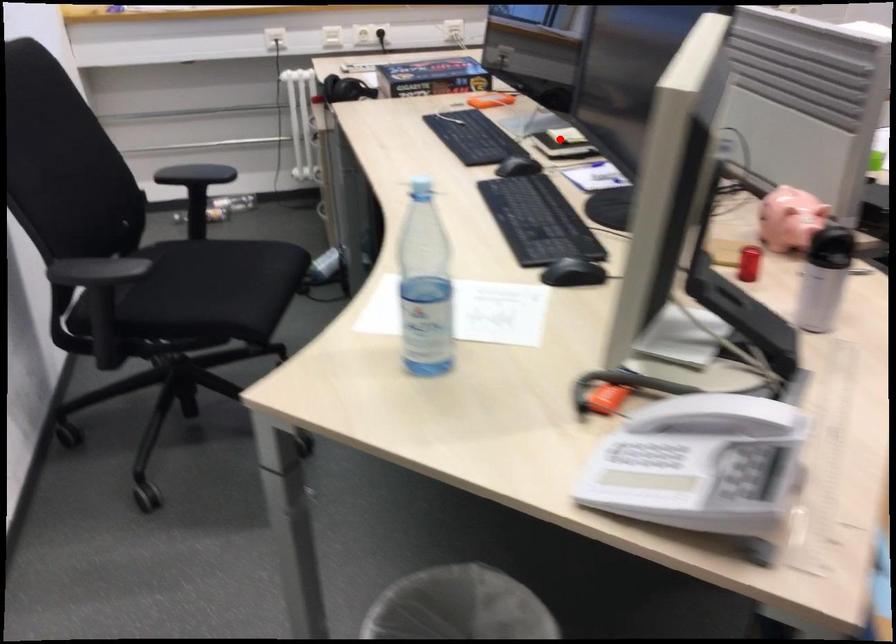
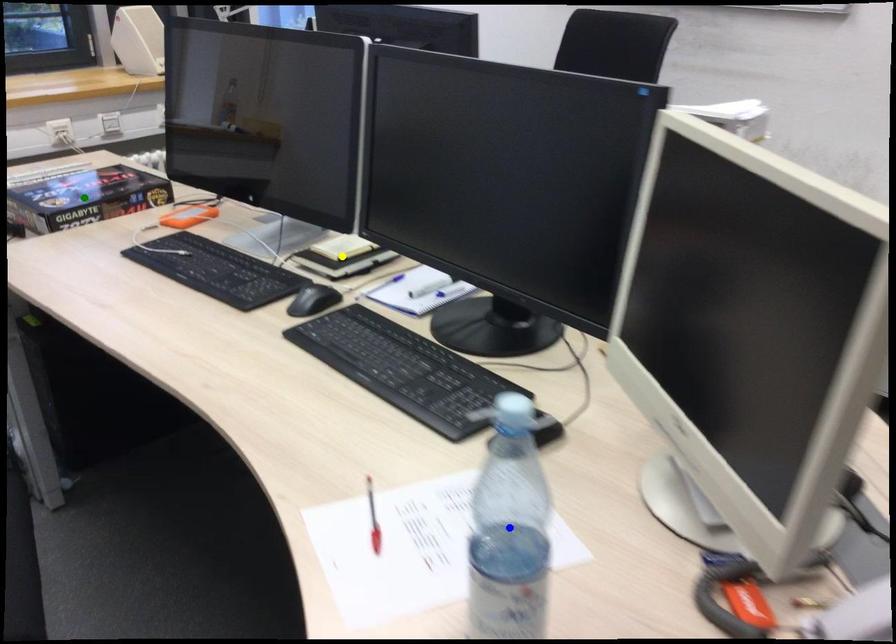
Question: I am providing you with two images of the same scene from different viewpoints. A red point is marked on the first image. You are given multiple points on the second image. Which point in image 2 represents the same 3d spot as the red point in image 1?

Choices:
 (A) yellow point
 (B) blue point
 (C) green point

Answer: (A)